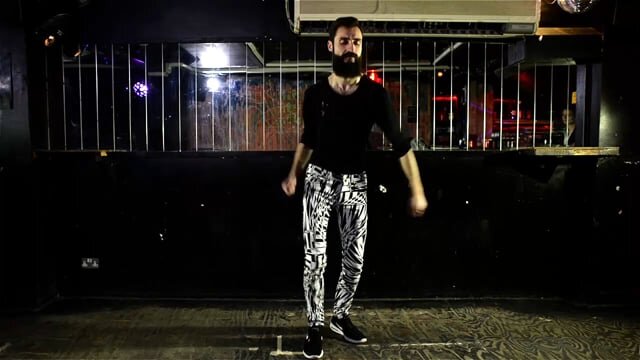
Identify the location of light reflection on the wall. (212, 82), (212, 56).